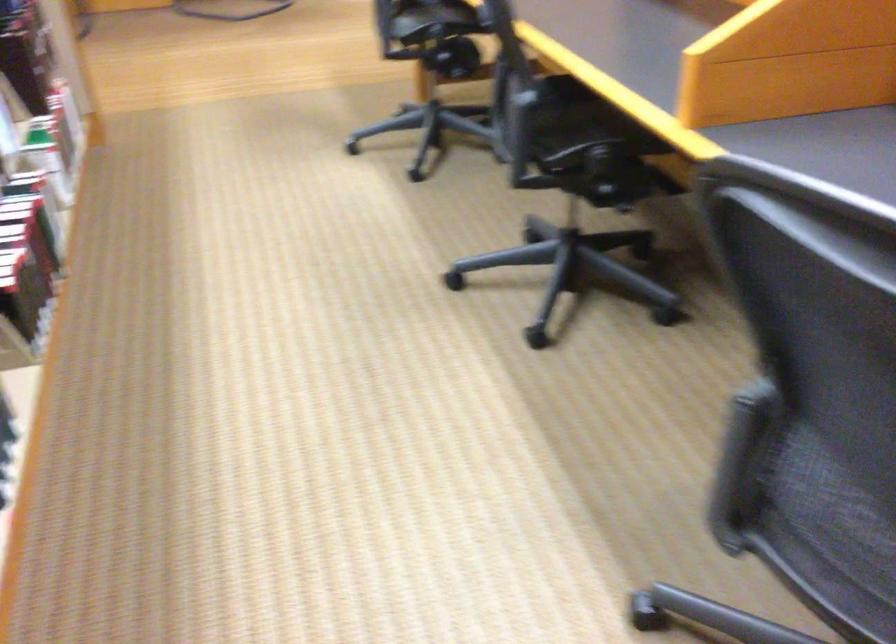
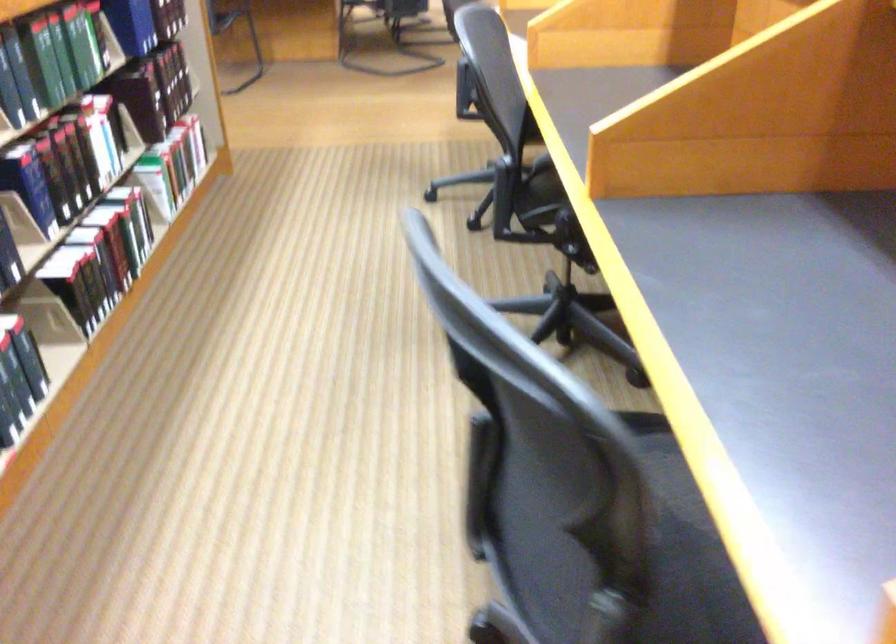
Question: In a continuous first-person perspective shot, in which direction is the camera moving?

Choices:
 (A) Left
 (B) Right
 (C) Forward
 (D) Backward

Answer: (B)